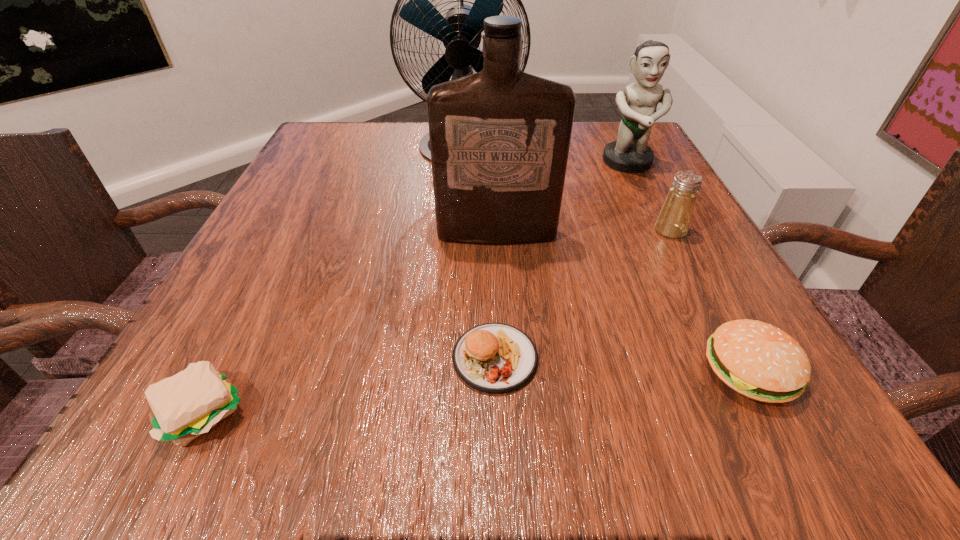
Identify the location of object at the near left corner. (184, 406).

In order to click on object present at the far right corner in this screenshot , I will do `click(630, 153)`.

Where is `object that is at the near right corner`? The image size is (960, 540). object that is at the near right corner is located at coordinates (760, 361).

Image resolution: width=960 pixels, height=540 pixels. In order to click on vacant space at the far edge of the desktop in this screenshot , I will do `click(409, 150)`.

Where is `vacant position at the near edge of the desktop`? vacant position at the near edge of the desktop is located at coordinates (381, 407).

Identify the location of vacant position at the left edge of the desktop. (366, 179).

In the image, there is a desktop. Identify the location of blank space at the right edge. (654, 255).

I want to click on vacant space at the far left corner of the desktop, so click(x=381, y=125).

The height and width of the screenshot is (540, 960). In order to click on vacant space at the near left corner of the desktop in this screenshot , I will do `click(170, 442)`.

Identify the location of free space at the far right corner. coord(610,127).